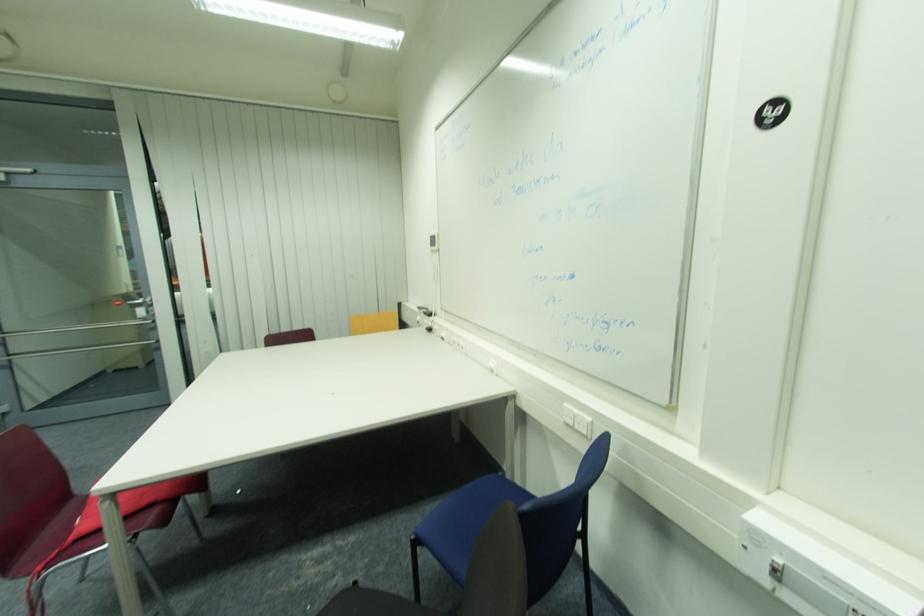
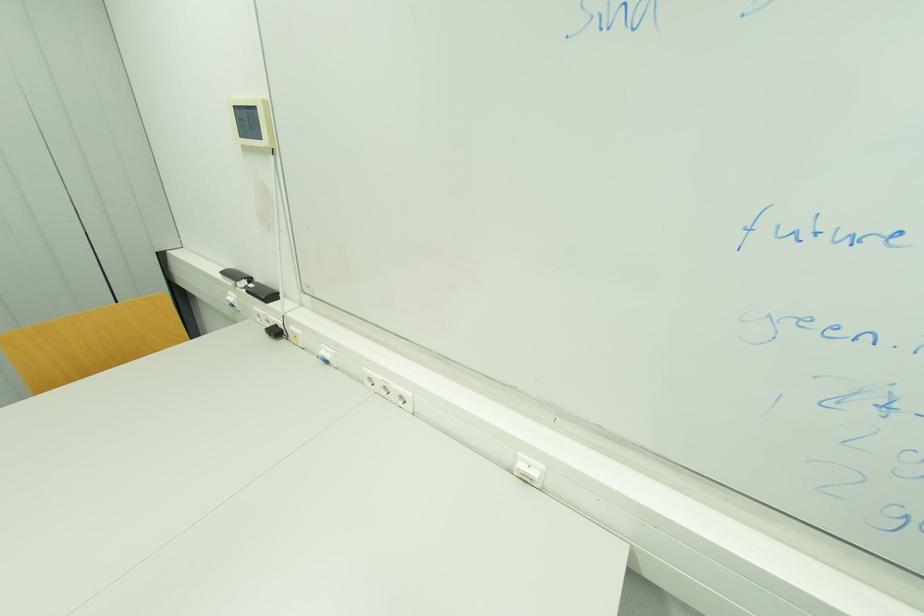
Locate, in the second image, the point that corresponds to (x=433, y=238) in the first image.

(237, 108)